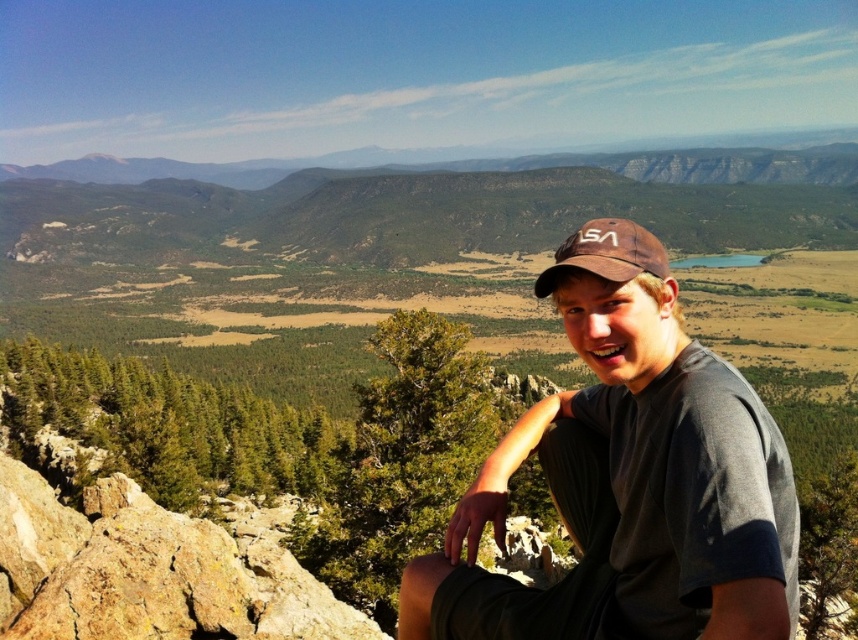
Based on the photo, can you confirm if dark gray t-shirt at center is positioned to the left of brown fabric cap at center?

Indeed, dark gray t-shirt at center is positioned on the left side of brown fabric cap at center.

Does dark gray t-shirt at center appear on the right side of brown fabric cap at center?

Incorrect, dark gray t-shirt at center is not on the right side of brown fabric cap at center.

Identify the location of dark gray t-shirt at center. This screenshot has width=858, height=640. (627, 480).